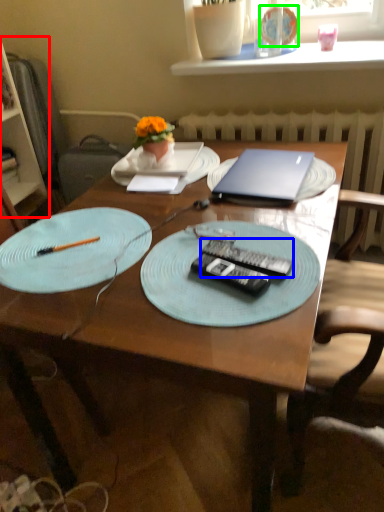
Question: Based on their relative distances, which object is farther from bookshelf (highlighted by a red box)? Choose from remote control (highlighted by a blue box) and tableware (highlighted by a green box).

Choices:
 (A) remote control
 (B) tableware

Answer: (A)